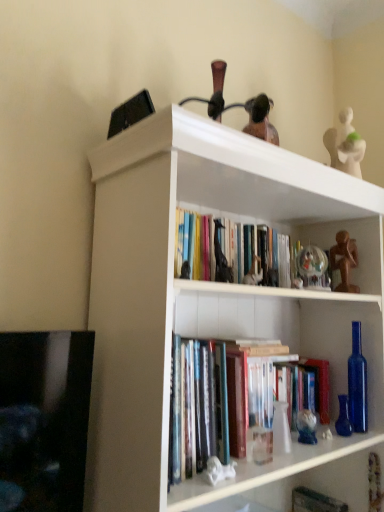
Question: From a real-world perspective, is transparent glass globe at upper center, acting as the second toy starting from the back, below white glossy statue at lower center, placed as the first toy when sorted from front to back?

Choices:
 (A) no
 (B) yes

Answer: (A)

Question: Are transparent glass globe at upper center, which appears as the fourth toy when viewed from the left, and white glossy statue at lower center, arranged as the 5th toy when viewed from the right, beside each other?

Choices:
 (A) no
 (B) yes

Answer: (A)

Question: Is transparent glass globe at upper center, placed as the second toy when sorted from right to left, taller than white glossy statue at lower center, acting as the 4th toy starting from the top?

Choices:
 (A) yes
 (B) no

Answer: (A)

Question: Is transparent glass globe at upper center, acting as the second toy starting from the back, surrounding white glossy statue at lower center, acting as the 5th toy starting from the back?

Choices:
 (A) no
 (B) yes

Answer: (A)

Question: From a real-world perspective, does transparent glass globe at upper center, which is the 3th toy from bottom to top, stand above white glossy statue at lower center, placed as the first toy when sorted from front to back?

Choices:
 (A) yes
 (B) no

Answer: (A)

Question: Considering the positions of hardcover books at center and white glossy statue at lower center, the 1th toy positioned from the left, in the image, is hardcover books at center bigger or smaller than white glossy statue at lower center, the 1th toy positioned from the left,?

Choices:
 (A) small
 (B) big

Answer: (B)

Question: Considering the positions of point click(x=276, y=279) and point click(x=208, y=471), is point click(x=276, y=279) closer or farther from the camera than point click(x=208, y=471)?

Choices:
 (A) closer
 (B) farther

Answer: (B)

Question: Based on their positions, is hardcover books at center located to the left or right of white glossy statue at lower center, acting as the 5th toy starting from the back?

Choices:
 (A) right
 (B) left

Answer: (A)

Question: Is hardcover books at center wider or thinner than white glossy statue at lower center, the 1th toy positioned from the left?

Choices:
 (A) thin
 (B) wide

Answer: (B)

Question: From the image's perspective, is transparent glass globe at upper center, which appears as the fourth toy when viewed from the left, located above or below hardcover books at center?

Choices:
 (A) above
 (B) below

Answer: (B)

Question: Is point (306, 281) positioned closer to the camera than point (251, 241)?

Choices:
 (A) farther
 (B) closer

Answer: (B)

Question: Visually, is transparent glass globe at upper center, acting as the second toy starting from the back, positioned to the left or to the right of hardcover books at center?

Choices:
 (A) left
 (B) right

Answer: (B)

Question: From a real-world perspective, is transparent glass globe at upper center, which appears as the fourth toy when viewed from the left, positioned above or below hardcover books at center?

Choices:
 (A) below
 (B) above

Answer: (A)

Question: From a real-world perspective, is matte black giraffe at center, which is counted as the 4th toy, starting from the back, positioned above or below hardcover book at center?

Choices:
 (A) below
 (B) above

Answer: (B)

Question: Considering the positions of matte black giraffe at center, which appears as the 2th toy when viewed from the front, and hardcover book at center in the image, is matte black giraffe at center, which appears as the 2th toy when viewed from the front, wider or thinner than hardcover book at center?

Choices:
 (A) thin
 (B) wide

Answer: (A)